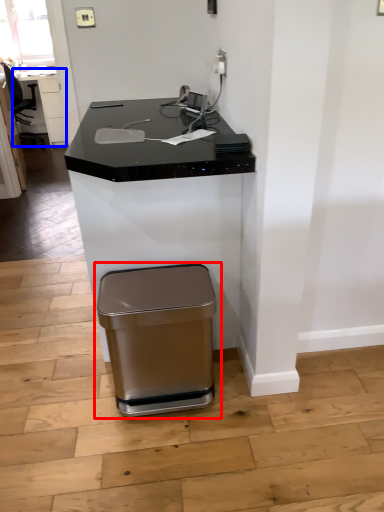
Question: Which object appears closest to the camera in this image, waste container (highlighted by a red box) or table (highlighted by a blue box)?

Choices:
 (A) waste container
 (B) table

Answer: (A)